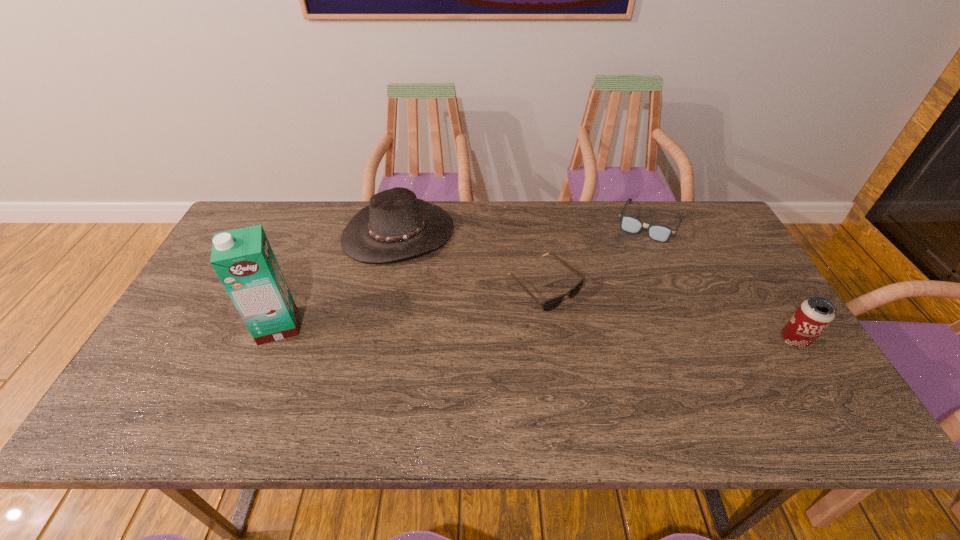
The image size is (960, 540). Find the location of `free space on the desktop that is between the carton and the rightmost object and is positioned on the front-facing side of the second object from left to right`. free space on the desktop that is between the carton and the rightmost object and is positioned on the front-facing side of the second object from left to right is located at coordinates (462, 331).

Image resolution: width=960 pixels, height=540 pixels. I want to click on free space on the desktop that is between the carton and the beer can and is positioned on the lenses of the shortest object, so click(602, 335).

Where is `free space on the desktop that is between the carton and the rightmost object and is positioned on the face of the second shortest object`? free space on the desktop that is between the carton and the rightmost object and is positioned on the face of the second shortest object is located at coordinates (597, 335).